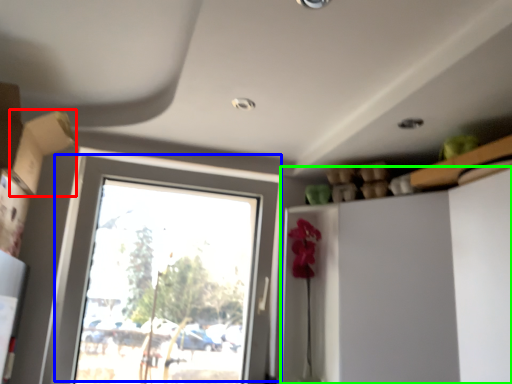
Question: Based on their relative distances, which object is farther from cardboard box (highlighted by a red box)? Choose from window (highlighted by a blue box) and dresser (highlighted by a green box).

Choices:
 (A) window
 (B) dresser

Answer: (B)